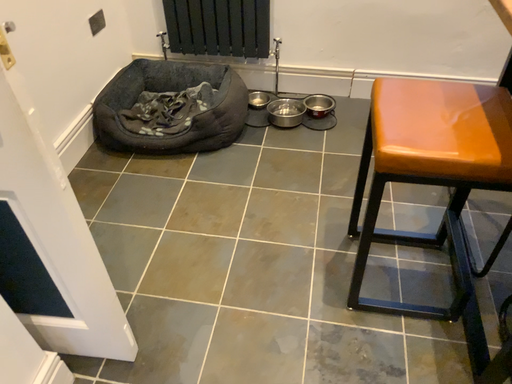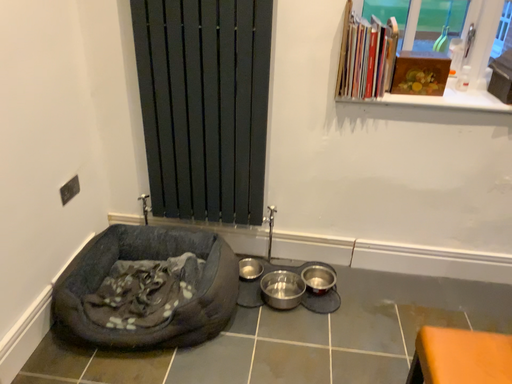
Question: Which way did the camera rotate in the video?

Choices:
 (A) rotated downward
 (B) rotated upward

Answer: (B)